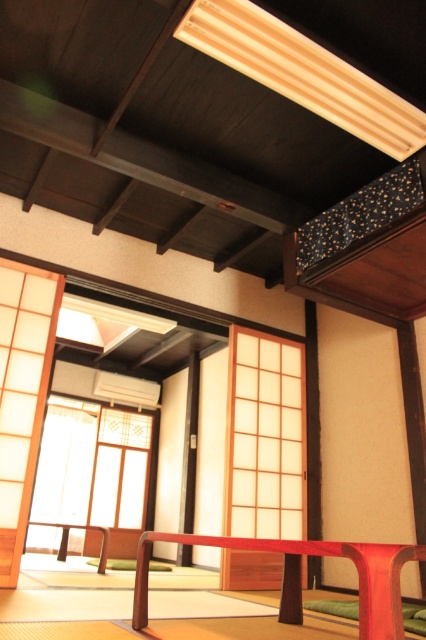
You are a guest in this Japanese room and need to place a 3.5 feet wide painting between the translucent wood window at center and the matte red table at center. Is there enough space between them to fit the painting?

The distance between the translucent wood window at center and the matte red table at center is 8.64 feet. Since the painting is 3.5 feet wide, there is sufficient space to place it between them as 8.64 feet is greater than 3.5 feet.

You are standing in the traditional Japanese room and want to move from the point at coordinates point (55, 492) to the point at coordinates point (287, 547). Which direction should you move to get closer to your destination?

You should move away from the camera because point (287, 547) is further away from the camera than point (55, 492).

Looking at this image, you are standing in a traditional Japanese room with sliding paper doors and tatami mats. You notice a point marked at coordinates (264, 436). What object is located at this point?

The point at coordinates (264, 436) corresponds to the translucent wood window at center.